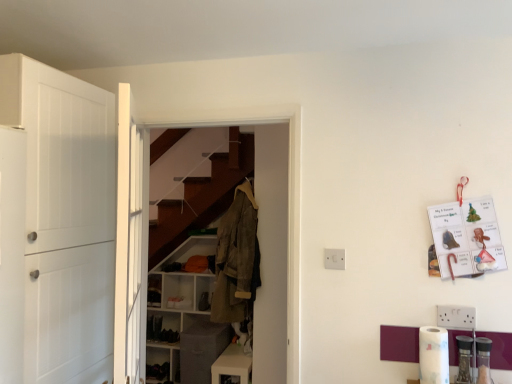
Question: Does point [x=245, y=289] appear closer or farther from the camera than point [x=233, y=360]?

Choices:
 (A) closer
 (B) farther

Answer: (A)

Question: Looking at the image, does khaki cotton jacket at center seem bigger or smaller compared to white glossy cabinet at lower center, which is the first cabinetry in right-to-left order?

Choices:
 (A) small
 (B) big

Answer: (B)

Question: Which is farther from the white wooden door at center, arranged as the 2th door when viewed from the left?

Choices:
 (A) white plastic electric outlet at center
 (B) white glossy cabinet at lower center, which is the first cabinetry in right-to-left order
 (C) khaki cotton jacket at center
 (D) white matte cabinet at center, the first cabinetry from the left
 (E) brown suede coat at center

Answer: (D)

Question: Estimate the real-world distances between objects in this image. Which object is farther from the white plastic electric outlet at center?

Choices:
 (A) white matte cabinet at center, which is the 2th cabinetry from front to back
 (B) white glossy cabinet at lower center, which is the first cabinetry in right-to-left order
 (C) white wooden door at center, the 1th door positioned from the right
 (D) khaki cotton jacket at center
 (E) white matte door at left, which appears as the second door when viewed from the right

Answer: (A)